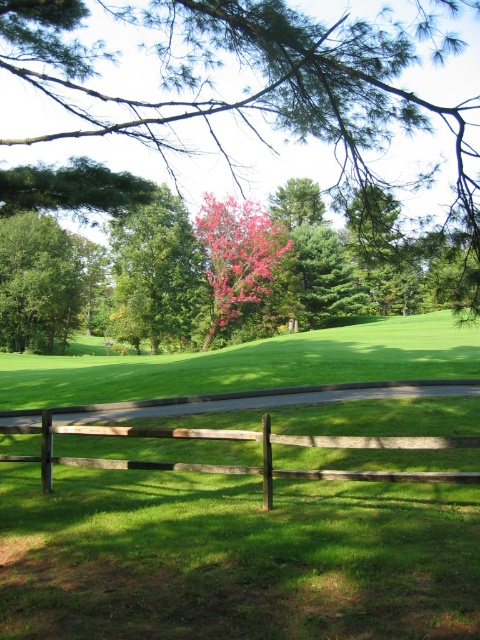
Is point (156, 289) less distant than point (64, 305)?

Yes, point (156, 289) is in front of point (64, 305).

I want to click on reddish-brown textured tree at center, so click(156, 273).

Where is `reddish-brown textured tree at center`? Image resolution: width=480 pixels, height=640 pixels. reddish-brown textured tree at center is located at coordinates (156, 273).

Which is behind, point (59, 289) or point (252, 205)?

Positioned behind is point (59, 289).

Locate an element on the screen. green matte tree at left is located at coordinates click(36, 284).

What do you see at coordinates (252, 76) in the screenshot? I see `green leafy tree at center` at bounding box center [252, 76].

Locate an element on the screen. The image size is (480, 640). green leafy tree at center is located at coordinates (252, 76).

You are a GUI agent. You are given a task and a screenshot of the screen. Output one action in this format:
    pyautogui.click(x=<x>, y=<y>)
    Task: Click on the green leafy tree at center
    
    Given the screenshot: What is the action you would take?
    [x=252, y=76]